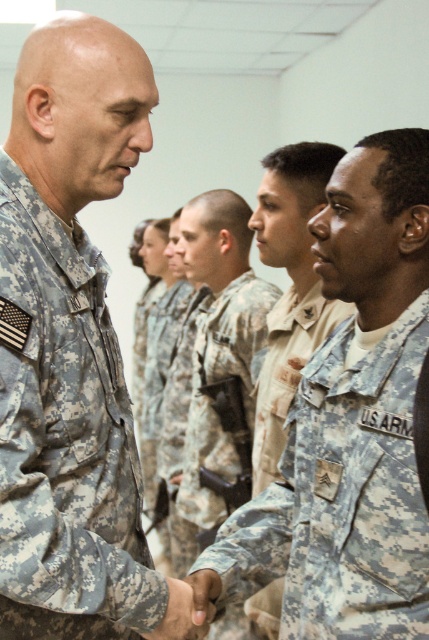
Which of these two, camouflage uniform at center or camouflage fabric uniform at left, stands taller?

Standing taller between the two is camouflage uniform at center.

Between camouflage uniform at center and camouflage fabric uniform at left, which one appears on the left side from the viewer's perspective?

From the viewer's perspective, camouflage fabric uniform at left appears more on the left side.

Image resolution: width=429 pixels, height=640 pixels. In order to click on camouflage uniform at center in this screenshot , I will do `click(349, 424)`.